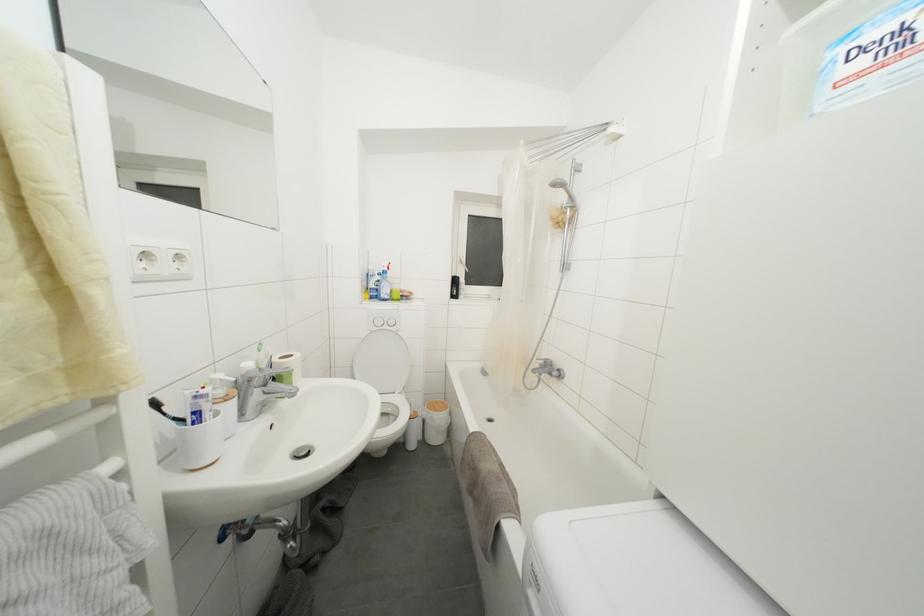
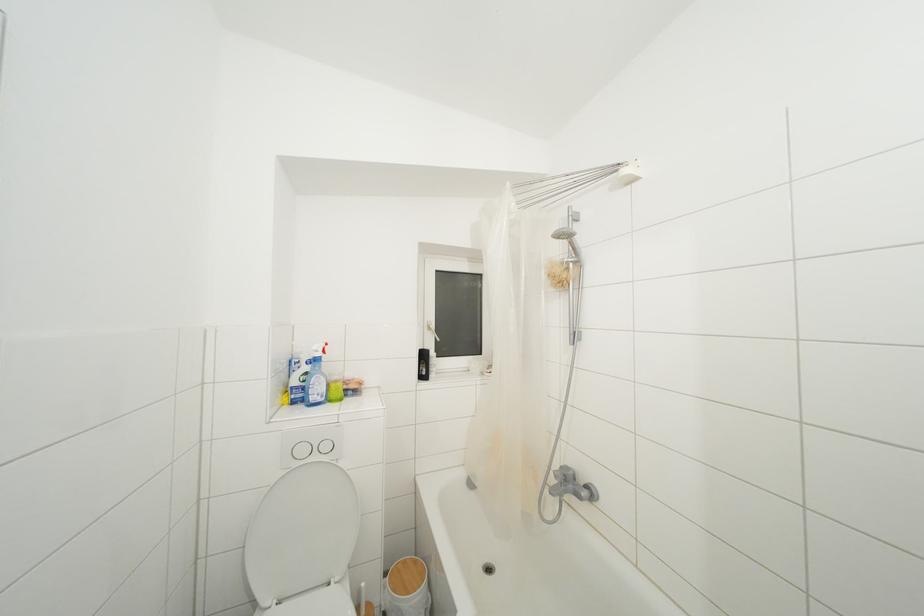
Where in the second image is the point corresponding to the point at 569,217 from the first image?

(572, 273)